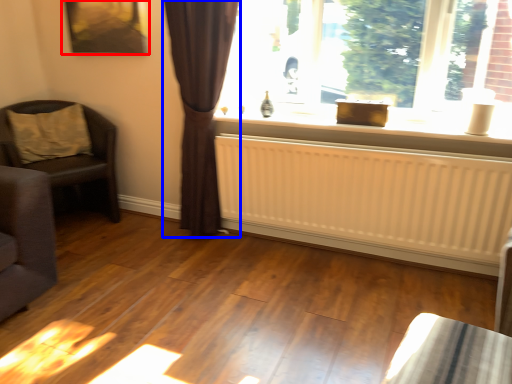
Question: Which point is closer to the camera, picture frame (highlighted by a red box) or curtain (highlighted by a blue box)?

Choices:
 (A) picture frame
 (B) curtain

Answer: (B)